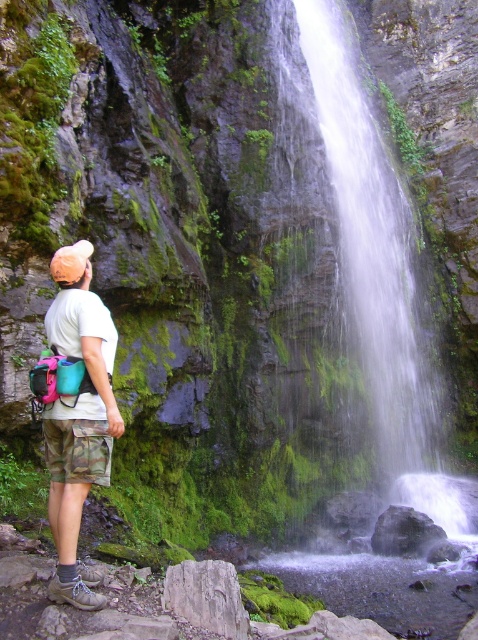
Question: Is green mossy waterfall at center wider than camo shorts at lower left?

Choices:
 (A) no
 (B) yes

Answer: (B)

Question: Can you confirm if green mossy waterfall at center is wider than camo shorts at lower left?

Choices:
 (A) yes
 (B) no

Answer: (A)

Question: Which of the following is the closest to the observer?

Choices:
 (A) green mossy waterfall at center
 (B) camo shorts at lower left

Answer: (B)

Question: Which object appears closest to the camera in this image?

Choices:
 (A) green mossy waterfall at center
 (B) camo shorts at lower left

Answer: (B)

Question: Can you confirm if green mossy waterfall at center is positioned to the right of camo shorts at lower left?

Choices:
 (A) yes
 (B) no

Answer: (A)

Question: Which of the following is the farthest from the observer?

Choices:
 (A) (419, 344)
 (B) (94, 333)

Answer: (A)